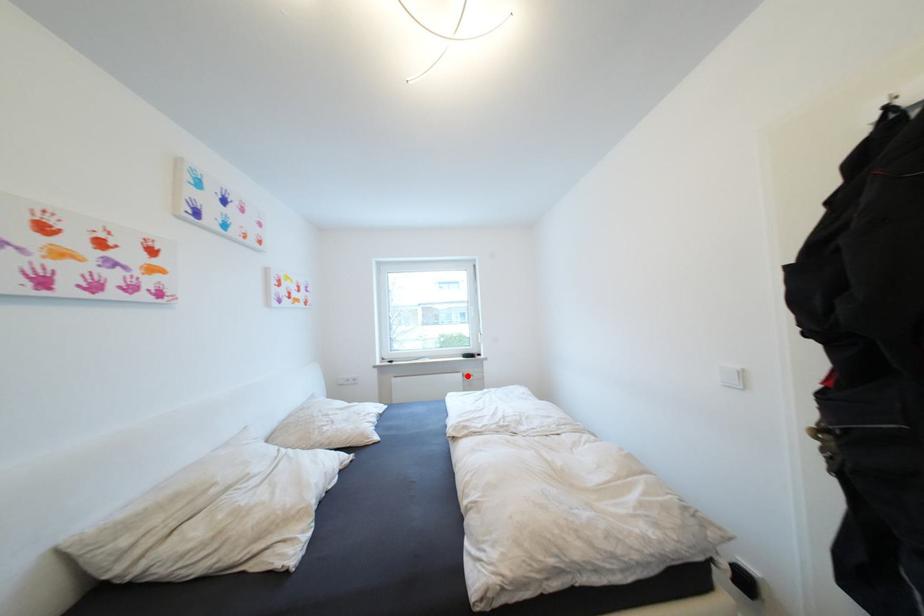
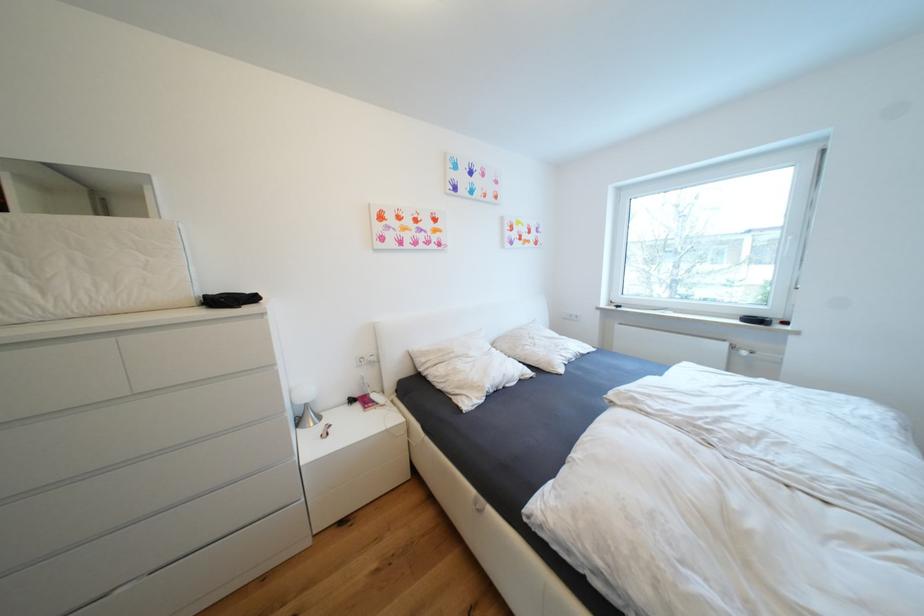
Question: I am providing you with two images of the same scene from different viewpoints. A red point is shown in image1. For the corresponding object point in image2, is it positioned nearer or farther from the camera?

Choices:
 (A) Nearer
 (B) Farther

Answer: (A)